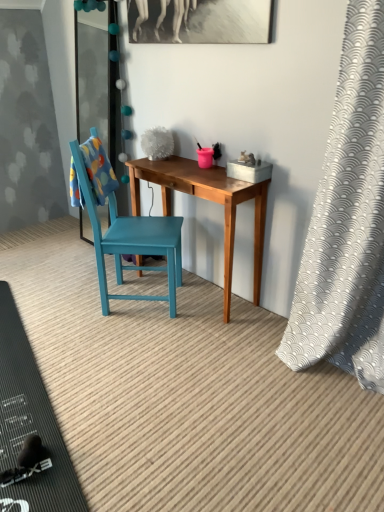
What are the coordinates of `wooden desk at center` in the screenshot? It's located at [x=209, y=200].

Locate an element on the screen. The width and height of the screenshot is (384, 512). black rubber mat at lower left is located at coordinates (30, 423).

Is point (310, 266) closer to camera compared to point (49, 490)?

No, (310, 266) is behind (49, 490).

Which is more to the left, white textured curtain at right or black rubber mat at lower left?

Positioned to the left is black rubber mat at lower left.

In terms of height, does white textured curtain at right look taller or shorter compared to black rubber mat at lower left?

In the image, white textured curtain at right appears to be taller than black rubber mat at lower left.

Is white textured curtain at right taller than wooden desk at center?

Yes.

Identify the location of curtain that is above the wooden desk at center (from a real-world perspective). Image resolution: width=384 pixels, height=512 pixels. pyautogui.click(x=347, y=220).

From a real-world perspective, is white textured curtain at right physically located above or below wooden desk at center?

white textured curtain at right is above wooden desk at center.

From the image's perspective, would you say white textured curtain at right is shown under wooden desk at center?

No.

In the image, there is a teal wooden chair at center. What are the coordinates of `curtain below it (from the image's perspective)` in the screenshot? It's located at (347, 220).

How distant is white textured curtain at right from teal wooden chair at center?

The distance of white textured curtain at right from teal wooden chair at center is 37.19 inches.

Looking at this image, from the image's perspective, is white textured curtain at right on teal wooden chair at center?

No.

Does white textured curtain at right lie in front of teal wooden chair at center?

That is True.

Is black rubber mat at lower left taller or shorter than wooden desk at center?

black rubber mat at lower left is shorter than wooden desk at center.

Is point (71, 483) farther from viewer compared to point (211, 167)?

No, (71, 483) is closer to viewer.

From a real-world perspective, is black rubber mat at lower left below wooden desk at center?

Yes, from a real-world perspective, black rubber mat at lower left is below wooden desk at center.

Is black rubber mat at lower left not near wooden desk at center?

black rubber mat at lower left is far away from wooden desk at center.

How much distance is there between teal wooden chair at center and wooden desk at center?

teal wooden chair at center and wooden desk at center are 12.83 inches apart from each other.

Considering the positions of objects teal wooden chair at center and wooden desk at center in the image provided, who is behind, teal wooden chair at center or wooden desk at center?

wooden desk at center is behind.

Considering the positions of objects teal wooden chair at center and wooden desk at center in the image provided, who is more to the left, teal wooden chair at center or wooden desk at center?

teal wooden chair at center.

I want to click on chair above the wooden desk at center (from the image's perspective), so click(x=131, y=241).

From the image's perspective, is wooden desk at center beneath teal wooden chair at center?

Correct, wooden desk at center appears lower than teal wooden chair at center in the image.

Is point (237, 181) positioned after point (155, 236)?

No, (237, 181) is closer to viewer.

Does wooden desk at center have a greater width compared to teal wooden chair at center?

No, wooden desk at center is not wider than teal wooden chair at center.

Between wooden desk at center and teal wooden chair at center, which one has larger size?

teal wooden chair at center.

Considering their positions, is wooden desk at center located in front of or behind black rubber mat at lower left?

In the image, wooden desk at center appears behind black rubber mat at lower left.

Is black rubber mat at lower left at the back of wooden desk at center?

No, wooden desk at center's orientation is not away from black rubber mat at lower left.

Visually, is wooden desk at center positioned to the left or to the right of black rubber mat at lower left?

Based on their positions, wooden desk at center is located to the right of black rubber mat at lower left.

Can you confirm if wooden desk at center is shorter than black rubber mat at lower left?

No.

At what (x,y) coordinates should I click in order to perform the action: click on mat below the white textured curtain at right (from the image's perspective). Please return your answer as a coordinate pair (x, y). The width and height of the screenshot is (384, 512). Looking at the image, I should click on (30, 423).

Where is `curtain located above the wooden desk at center (from the image's perspective)`? The width and height of the screenshot is (384, 512). curtain located above the wooden desk at center (from the image's perspective) is located at coordinates (347, 220).

Based on their spatial positions, is white textured curtain at right or black rubber mat at lower left closer to wooden desk at center?

white textured curtain at right is positioned closer to the anchor wooden desk at center.

Considering their positions, is black rubber mat at lower left positioned further to wooden desk at center than teal wooden chair at center?

Among the two, black rubber mat at lower left is located further to wooden desk at center.

When comparing their distances from wooden desk at center, does black rubber mat at lower left or white textured curtain at right seem further?

black rubber mat at lower left is further to wooden desk at center.

Which object lies further to the anchor point white textured curtain at right, teal wooden chair at center or wooden desk at center?

The object further to white textured curtain at right is teal wooden chair at center.

Considering their positions, is wooden desk at center positioned further to teal wooden chair at center than white textured curtain at right?

white textured curtain at right lies further to teal wooden chair at center than the other object.

Considering their positions, is teal wooden chair at center positioned further to white textured curtain at right than black rubber mat at lower left?

black rubber mat at lower left lies further to white textured curtain at right than the other object.

From the image, which object appears to be farther from teal wooden chair at center, black rubber mat at lower left or white textured curtain at right?

Based on the image, white textured curtain at right appears to be further to teal wooden chair at center.

When comparing their distances from white textured curtain at right, does wooden desk at center or teal wooden chair at center seem closer?

wooden desk at center lies closer to white textured curtain at right than the other object.

Image resolution: width=384 pixels, height=512 pixels. What are the coordinates of `chair between black rubber mat at lower left and white textured curtain at right in the horizontal direction` in the screenshot? It's located at (131, 241).

Find the location of a particular element. chair between white textured curtain at right and wooden desk at center along the z-axis is located at coordinates (131, 241).

Identify the location of desk between black rubber mat at lower left and white textured curtain at right from left to right. The width and height of the screenshot is (384, 512). (209, 200).

Find the location of a particular element. The width and height of the screenshot is (384, 512). chair situated between black rubber mat at lower left and wooden desk at center from left to right is located at coordinates (131, 241).